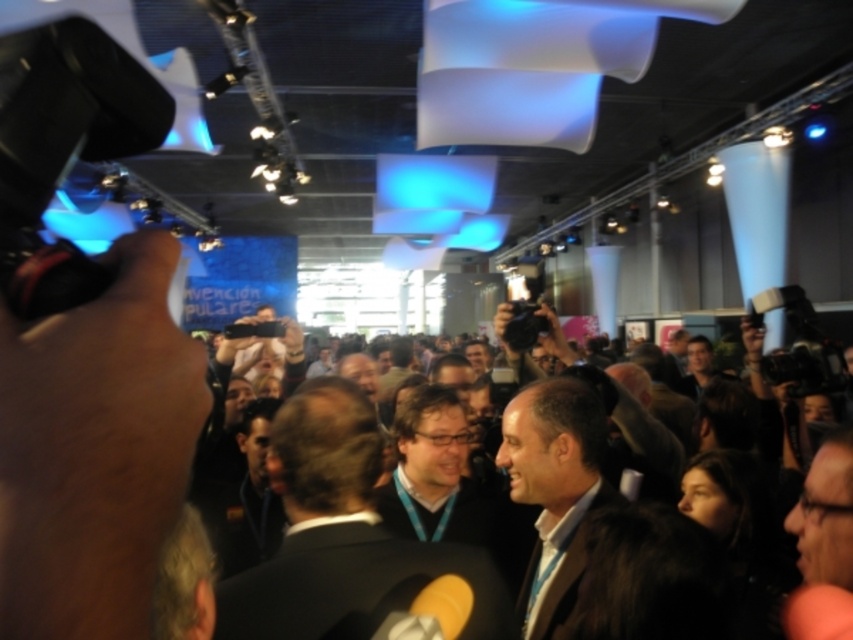
Question: Does black suit at center have a smaller size compared to dark suit jacket at center?

Choices:
 (A) yes
 (B) no

Answer: (A)

Question: Can you confirm if matte black suit at center is positioned below matte black jacket at center?

Choices:
 (A) yes
 (B) no

Answer: (B)

Question: Is black suit at center to the left of matte black suit at center from the viewer's perspective?

Choices:
 (A) yes
 (B) no

Answer: (A)

Question: Among these objects, which one is nearest to the camera?

Choices:
 (A) dark brown hair at center
 (B) matte black suit at center
 (C) black suit at center

Answer: (C)

Question: Which point is closer to the camera?

Choices:
 (A) dark suit jacket at center
 (B) matte black suit at center

Answer: (B)

Question: Which of the following is the farthest from the observer?

Choices:
 (A) coord(340,632)
 (B) coord(796,372)
 (C) coord(573,570)

Answer: (B)